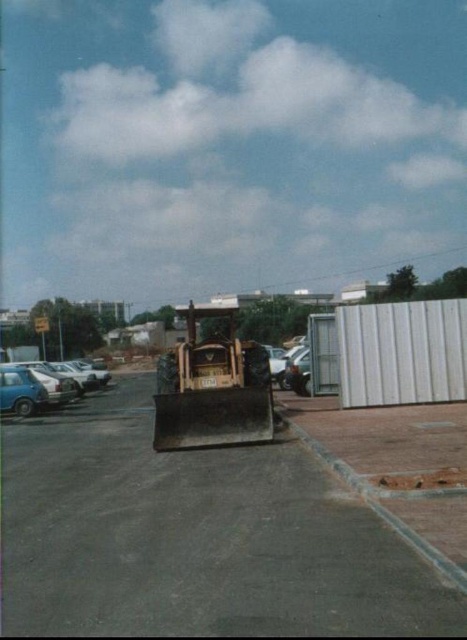
Question: Considering the relative positions of concrete asphalt parking lot at center and metallic yellow excavator at center in the image provided, where is concrete asphalt parking lot at center located with respect to metallic yellow excavator at center?

Choices:
 (A) above
 (B) below

Answer: (B)

Question: Which object appears farthest from the camera in this image?

Choices:
 (A) concrete asphalt parking lot at center
 (B) metallic yellow excavator at center

Answer: (B)

Question: Does concrete asphalt parking lot at center lie in front of matte blue car at left?

Choices:
 (A) no
 (B) yes

Answer: (B)

Question: Which of the following is the farthest from the observer?

Choices:
 (A) (217, 362)
 (B) (63, 596)
 (C) (72, 390)

Answer: (C)

Question: Is concrete asphalt parking lot at center to the left of metallic yellow excavator at center from the viewer's perspective?

Choices:
 (A) no
 (B) yes

Answer: (B)

Question: Which point is closer to the camera?

Choices:
 (A) concrete asphalt parking lot at center
 (B) matte blue car at left
 (C) metallic yellow excavator at center

Answer: (A)